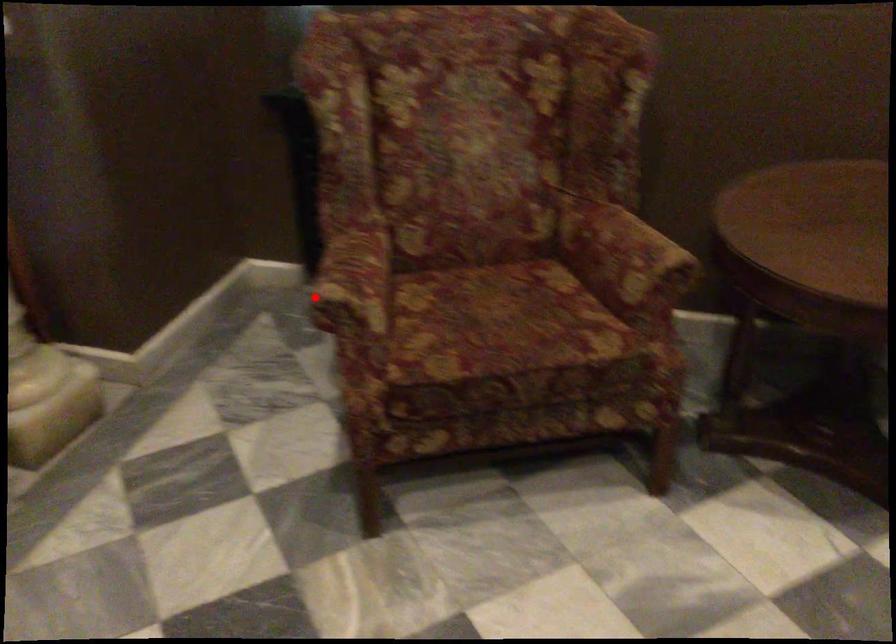
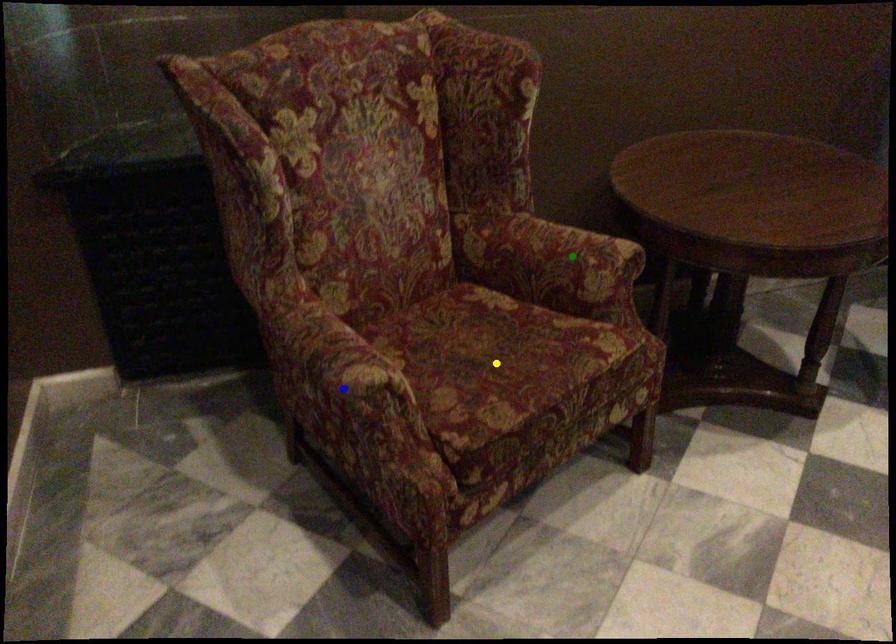
Question: I am providing you with two images of the same scene from different viewpoints. A red point is marked on the first image. You are given multiple points on the second image. Which point in image 2 is actually the same real-world point as the red point in image 1?

Choices:
 (A) blue point
 (B) yellow point
 (C) green point

Answer: (A)